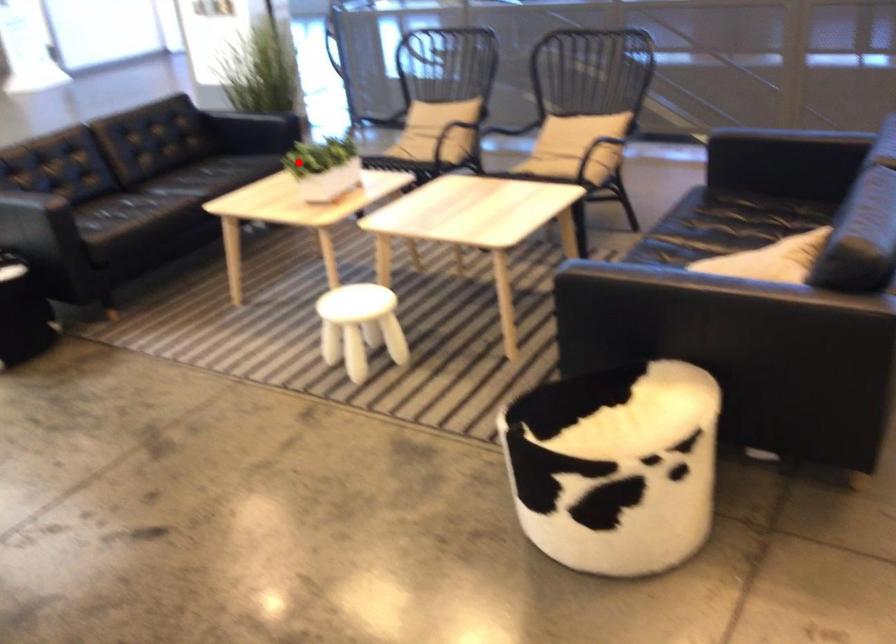
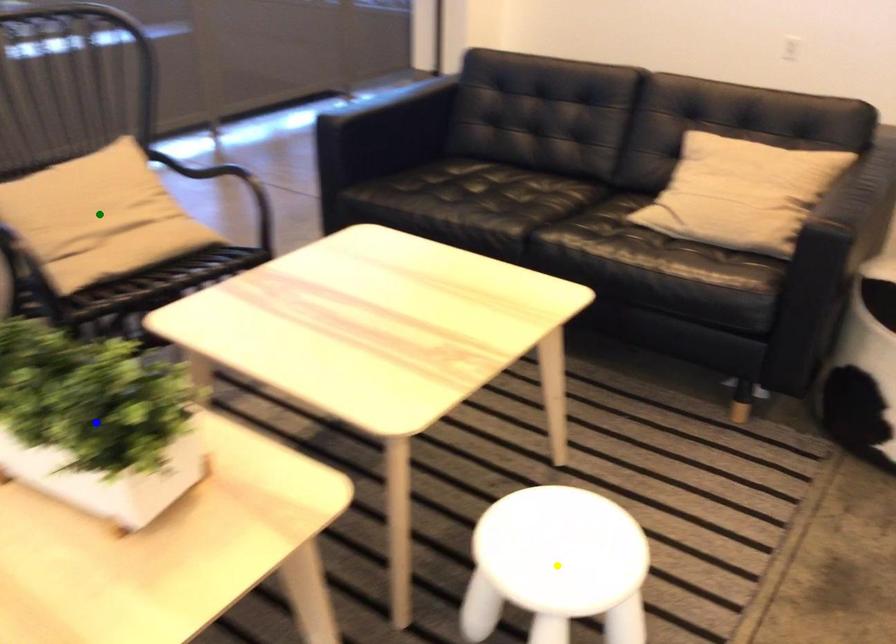
Question: I am providing you with two images of the same scene from different viewpoints. A red point is marked on the first image. You are given multiple points on the second image. Which point in image 2 represents the same 3d spot as the red point in image 1?

Choices:
 (A) yellow point
 (B) blue point
 (C) green point

Answer: (B)